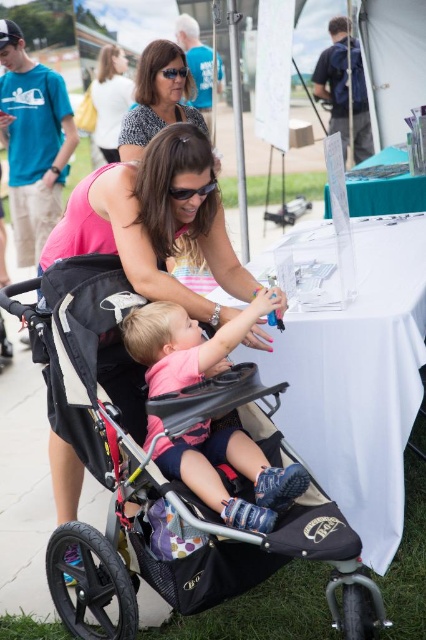
Who is more forward, (230, 262) or (91, 96)?

Point (230, 262) is in front.

Does pink fabric at center appear on the left side of matte black stroller at upper center?

Incorrect, pink fabric at center is not on the left side of matte black stroller at upper center.

Which is in front, point (106, 170) or point (121, 61)?

Point (106, 170)

Identify the location of pink fabric at center. (155, 221).

Is black fabric stroller at center closer to camera compared to pink fabric at center?

Yes, black fabric stroller at center is closer to the viewer.

Is black fabric stroller at center wider than pink fabric at center?

Yes.

Image resolution: width=426 pixels, height=640 pixels. What do you see at coordinates (158, 484) in the screenshot?
I see `black fabric stroller at center` at bounding box center [158, 484].

Locate an element on the screen. This screenshot has height=640, width=426. black fabric stroller at center is located at coordinates (158, 484).

What do you see at coordinates (155, 221) in the screenshot? I see `pink fabric at center` at bounding box center [155, 221].

Which is more to the left, pink fabric at center or matte pink shirt at upper center?

matte pink shirt at upper center

Measure the distance between point (117, 396) and camera.

They are 8.80 feet apart.

Locate an element on the screen. The image size is (426, 640). pink fabric at center is located at coordinates (155, 221).